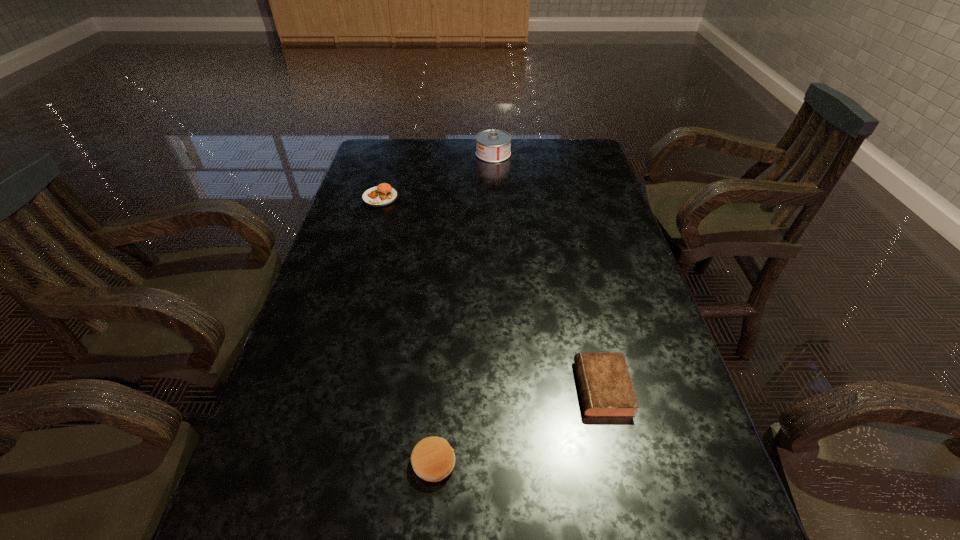
Identify the location of vacant space at the far right corner. (567, 151).

Where is `empty space between the farthest object and the second farthest object`? empty space between the farthest object and the second farthest object is located at coordinates (437, 176).

You are a GUI agent. You are given a task and a screenshot of the screen. Output one action in this format:
    pyautogui.click(x=<x>, y=<y>)
    Task: Click on the free space between the diary and the farther patty
    
    Given the screenshot: What is the action you would take?
    pyautogui.click(x=492, y=293)

At what (x,y) coordinates should I click in order to perform the action: click on vacant region between the left patty and the farthest object. Please return your answer as a coordinate pair (x, y). The image size is (960, 540). Looking at the image, I should click on (437, 176).

Find the location of a particular element. free space between the diary and the right patty is located at coordinates (518, 426).

Locate an element on the screen. vacant area that lies between the can and the third nearest object is located at coordinates (437, 176).

At what (x,y) coordinates should I click in order to perform the action: click on vacant area that lies between the tallest object and the diary. Please return your answer as a coordinate pair (x, y). The width and height of the screenshot is (960, 540). Looking at the image, I should click on (548, 271).

Image resolution: width=960 pixels, height=540 pixels. What are the coordinates of `vacant space in between the nearer patty and the farther patty` in the screenshot? It's located at (407, 330).

Locate an element on the screen. free spot between the farther patty and the rightmost object is located at coordinates (492, 293).

Identify the location of free space between the nearer patty and the can. (464, 308).